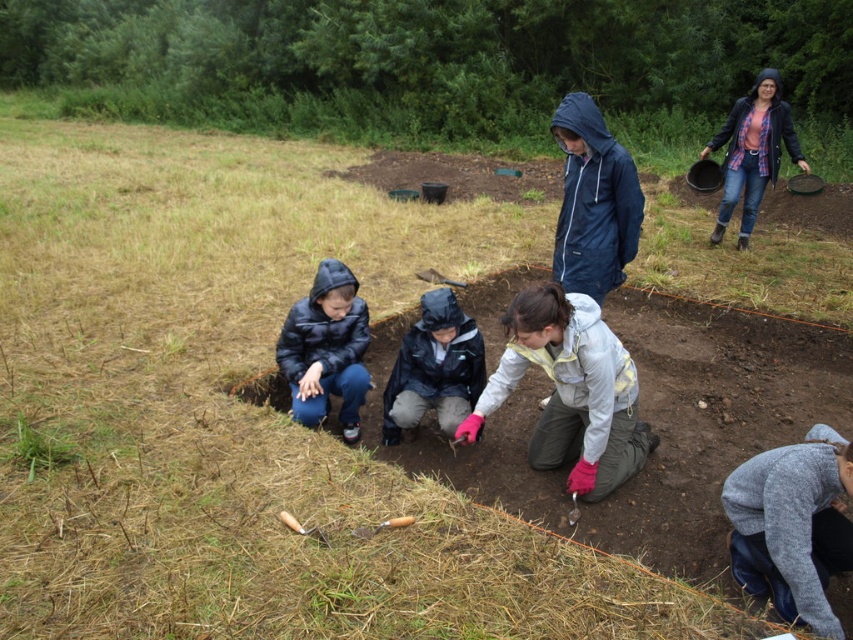
Question: Is blue waterproof jacket at upper center closer to camera compared to black matte jacket at center?

Choices:
 (A) no
 (B) yes

Answer: (A)

Question: Which object is farther from the camera taking this photo?

Choices:
 (A) white fleece jacket at center
 (B) blue waterproof jacket at upper center

Answer: (B)

Question: Is the position of matte black jacket at lower left less distant than that of brushed metal shovel at center?

Choices:
 (A) no
 (B) yes

Answer: (B)

Question: In this image, where is matte black jacket at lower left located relative to brushed metal shovel at center?

Choices:
 (A) left
 (B) right

Answer: (A)

Question: Which point is closer to the camera?

Choices:
 (A) (436, 276)
 (B) (618, 422)
 (C) (302, 314)
 (D) (421, 417)

Answer: (B)

Question: Which object is positioned closest to the blue waterproof jacket at upper center?

Choices:
 (A) gray sweater at lower right
 (B) black matte jacket at center
 (C) matte black jacket at lower left

Answer: (B)